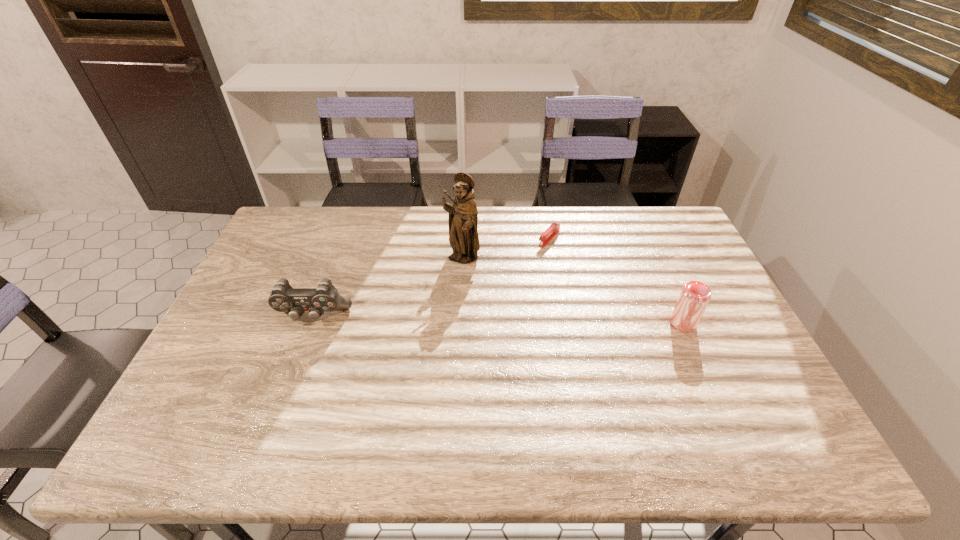
Locate an element on the screen. The height and width of the screenshot is (540, 960). vacant space on the desktop that is between the leftmost object and the beer can and is positioned on the front-facing side of the third object from left to right is located at coordinates (469, 320).

Where is `free space on the desktop that is between the control and the beer can and is positioned on the front-facing side of the second object from left to right`? The image size is (960, 540). free space on the desktop that is between the control and the beer can and is positioned on the front-facing side of the second object from left to right is located at coordinates (448, 319).